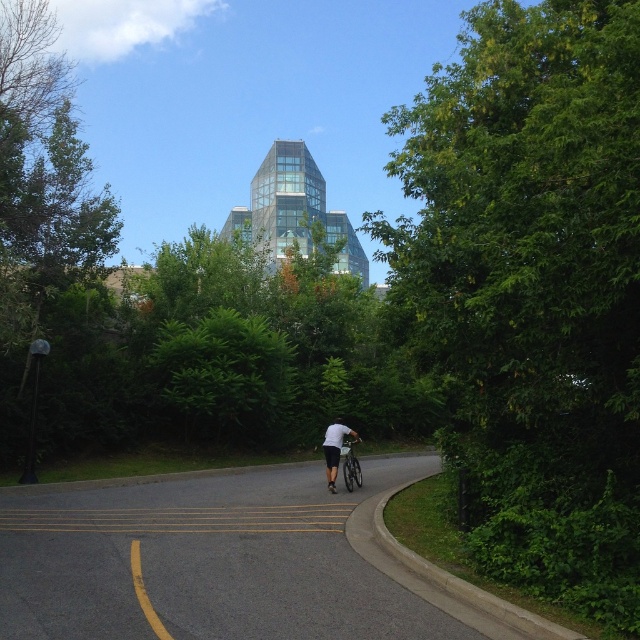
Can you confirm if green leafy tree at center is thinner than white matte shirt at center?

Incorrect, green leafy tree at center's width is not less than white matte shirt at center's.

Which is more to the right, green leafy tree at center or white matte shirt at center?

green leafy tree at center

I want to click on green leafy tree at center, so click(x=531, y=291).

Where is `green leafy tree at center`? green leafy tree at center is located at coordinates (531, 291).

Who is positioned more to the left, green leafy tree at center or black asphalt bike lane at center?

From the viewer's perspective, black asphalt bike lane at center appears more on the left side.

Does point (593, 24) come farther from viewer compared to point (349, 547)?

That is False.

Is point (605, 209) behind point (362, 589)?

No.

I want to click on green leafy tree at center, so click(531, 291).

Can you confirm if black asphalt bike lane at center is thinner than white matte shirt at center?

No.

Which is below, black asphalt bike lane at center or white matte shirt at center?

white matte shirt at center is lower down.

Measure the distance between point (204, 634) and camera.

6.00 meters

Locate an element on the screen. This screenshot has width=640, height=640. black asphalt bike lane at center is located at coordinates (220, 563).